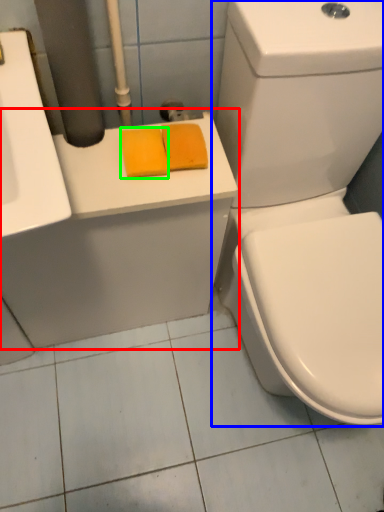
Question: Estimate the real-world distances between objects in this image. Which object is closer to counter top (highlighted by a red box), toilet (highlighted by a blue box) or soap (highlighted by a green box)?

Choices:
 (A) toilet
 (B) soap

Answer: (A)